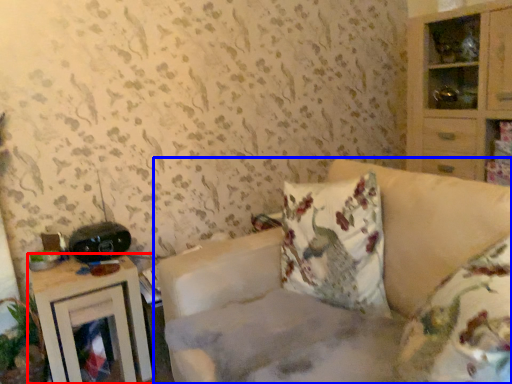
Question: Which point is closer to the camera, nightstand (highlighted by a red box) or studio couch (highlighted by a blue box)?

Choices:
 (A) nightstand
 (B) studio couch

Answer: (B)